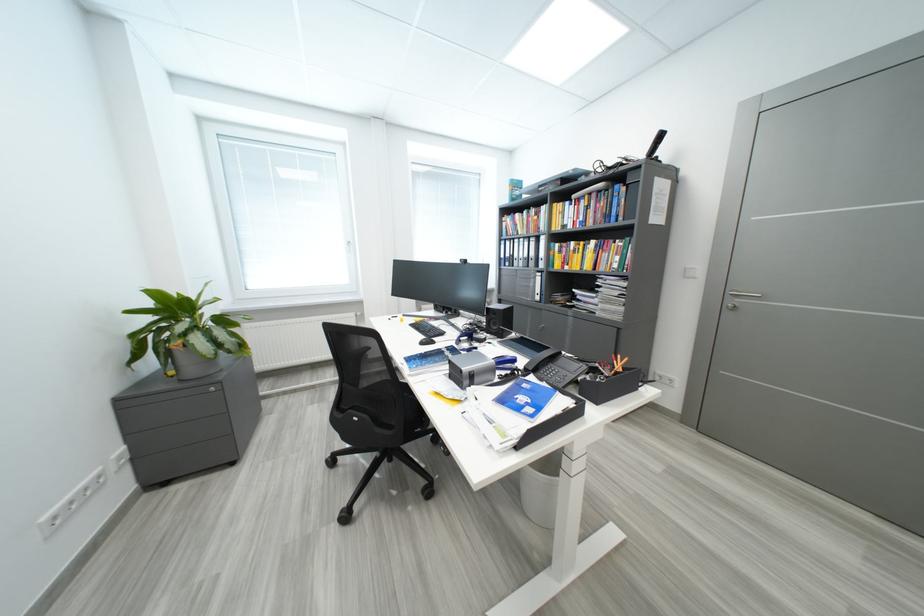
The height and width of the screenshot is (616, 924). I want to click on white waste bin, so click(541, 488).